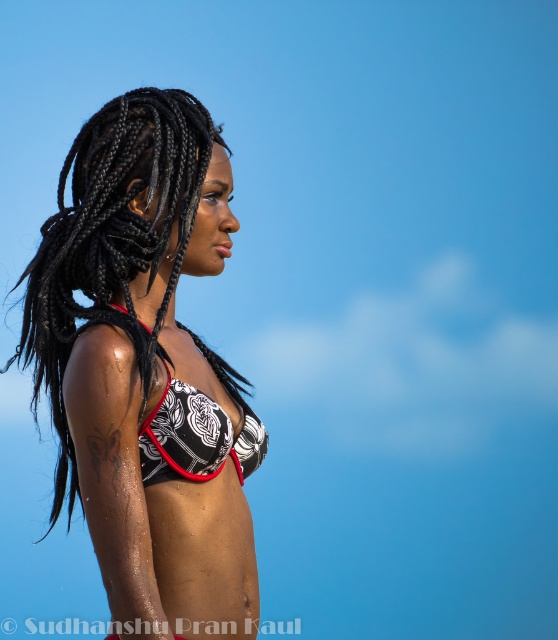
Question: Which of the following is the farthest from the observer?

Choices:
 (A) black printed bikini top at center
 (B) printed fabric bikini top at center

Answer: (A)

Question: Does printed fabric bikini top at center come behind black printed bikini top at center?

Choices:
 (A) no
 (B) yes

Answer: (A)

Question: Does printed fabric bikini top at center have a smaller size compared to black printed bikini top at center?

Choices:
 (A) no
 (B) yes

Answer: (A)

Question: Does printed fabric bikini top at center lie behind black printed bikini top at center?

Choices:
 (A) no
 (B) yes

Answer: (A)